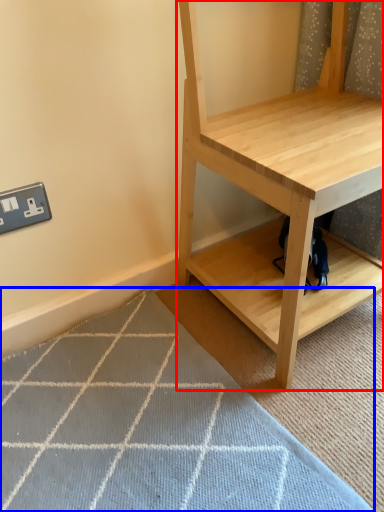
Question: Which point is closer to the camera, shelf (highlighted by a red box) or doormat (highlighted by a blue box)?

Choices:
 (A) shelf
 (B) doormat

Answer: (A)